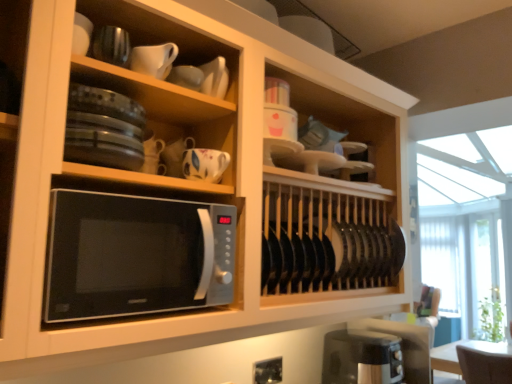
Question: Relative to white glossy cup at upper center, the 2th tableware from the top, is glossy ceramic mug at upper center, which is counted as the fourth tableware, starting from the top, in front or behind?

Choices:
 (A) front
 (B) behind

Answer: (A)

Question: Based on their sizes in the image, would you say glossy ceramic mug at upper center, which is counted as the first tableware, starting from the bottom, is bigger or smaller than white glossy cup at upper center, the 2th tableware from the top?

Choices:
 (A) small
 (B) big

Answer: (B)

Question: Estimate the real-world distances between objects in this image. Which object is farther from the black plastic toaster at lower right?

Choices:
 (A) matte white cup at upper center, which is counted as the second tableware, starting from the bottom
 (B) white glossy cup at upper center, the 2th tableware from the top
 (C) glossy ceramic mug at upper center, which is counted as the fourth tableware, starting from the top
 (D) white matte pitcher at upper center, which is counted as the 1th tableware, starting from the top
 (E) sleek silver microwave at center

Answer: (D)

Question: Estimate the real-world distances between objects in this image. Which object is closer to the sleek silver microwave at center?

Choices:
 (A) black plastic toaster at lower right
 (B) matte white cup at upper center, which is counted as the second tableware, starting from the bottom
 (C) white glossy cup at upper center, the 2th tableware from the top
 (D) glossy ceramic mug at upper center, which is counted as the first tableware, starting from the bottom
 (E) white matte pitcher at upper center, which ranks as the 4th tableware in bottom-to-top order

Answer: (D)